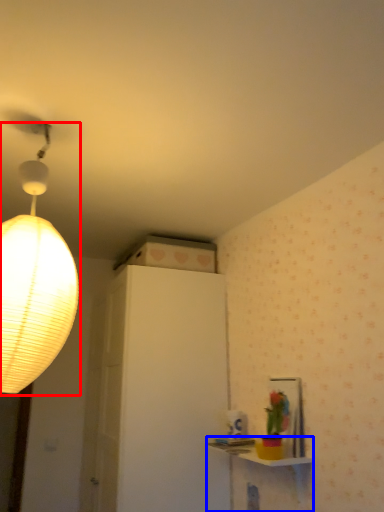
Question: Among these objects, which one is farthest to the camera, lamp (highlighted by a red box) or table (highlighted by a blue box)?

Choices:
 (A) lamp
 (B) table

Answer: (B)